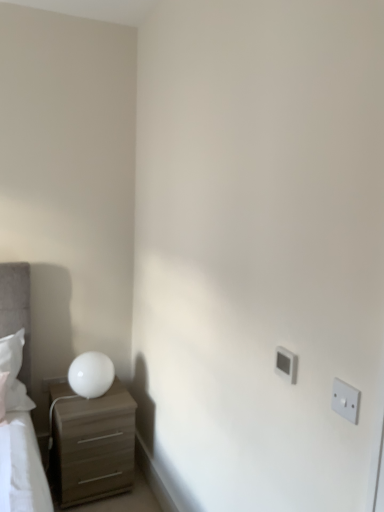
Find the location of `free spot in front of white glossy table lamp at left`. free spot in front of white glossy table lamp at left is located at coordinates (80, 409).